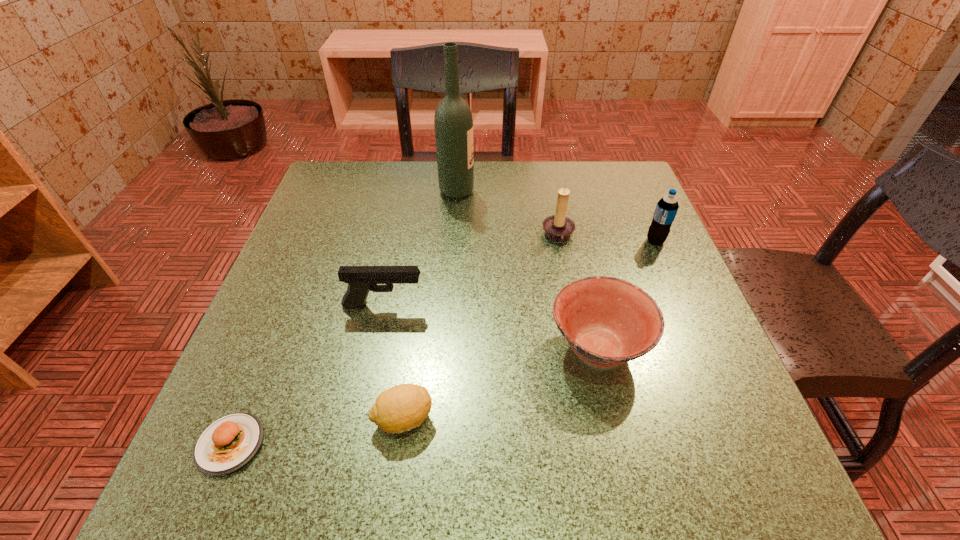
This screenshot has height=540, width=960. I want to click on vacant point that satisfies the following two spatial constraints: 1. on the labeled side of the third nearest object; 2. on the left side of the wine bottle, so click(446, 348).

At what (x,y) coordinates should I click in order to perform the action: click on free spot that satisfies the following two spatial constraints: 1. on the labeled side of the third nearest object; 2. on the left side of the farthest object. Please return your answer as a coordinate pair (x, y). The width and height of the screenshot is (960, 540). Looking at the image, I should click on (446, 348).

Locate an element on the screen. This screenshot has width=960, height=540. free location that satisfies the following two spatial constraints: 1. on the back side of the fifth farthest object; 2. on the labeled side of the wine bottle is located at coordinates (562, 191).

Locate an element on the screen. blank space that satisfies the following two spatial constraints: 1. on the front side of the soda bottle; 2. at the stem end of the lemon is located at coordinates (732, 419).

Identify the location of free point that satisfies the following two spatial constraints: 1. on the back side of the soda bottle; 2. on the wick of the candle holder. (653, 236).